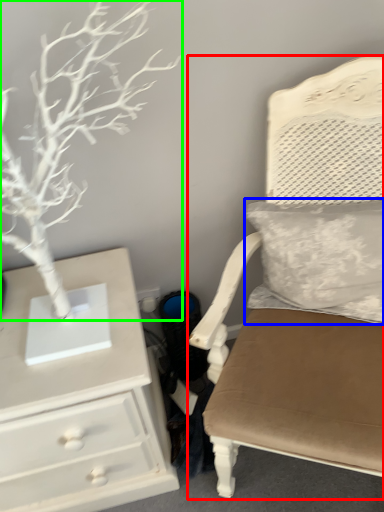
Question: Based on their relative distances, which object is farther from chair (highlighted by a red box)? Choose from pillow (highlighted by a blue box) and tree (highlighted by a green box).

Choices:
 (A) pillow
 (B) tree

Answer: (B)